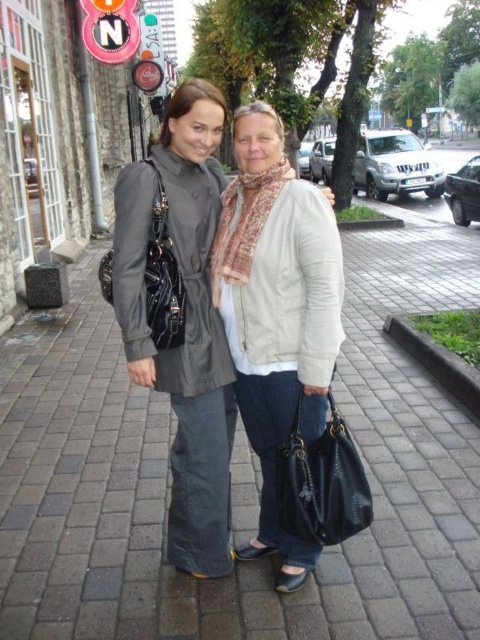
Between point (173, 340) and point (88, 10), which one is positioned behind?

The point (88, 10) is behind.

Is matte black bag at left positioned before brushed metal sign at upper center?

Yes, matte black bag at left is closer to the viewer.

Find the location of `matte black bag at left`. matte black bag at left is located at coordinates (163, 276).

How distant is matte gray pavement at center from matte black bag at left?

matte gray pavement at center is 2.81 meters from matte black bag at left.

Which is more to the right, matte gray pavement at center or matte black bag at left?

From the viewer's perspective, matte gray pavement at center appears more on the right side.

Measure the distance between point (360, 536) and camera.

Point (360, 536) is 8.82 feet from camera.

Image resolution: width=480 pixels, height=640 pixels. Find the location of `matte gray pavement at center`. matte gray pavement at center is located at coordinates (169, 477).

Which is behind, point (72, 291) or point (252, 256)?

Positioned behind is point (72, 291).

What do you see at coordinates (169, 477) in the screenshot?
I see `matte gray pavement at center` at bounding box center [169, 477].

Identify the location of matte gray pavement at center. This screenshot has height=640, width=480. (169, 477).